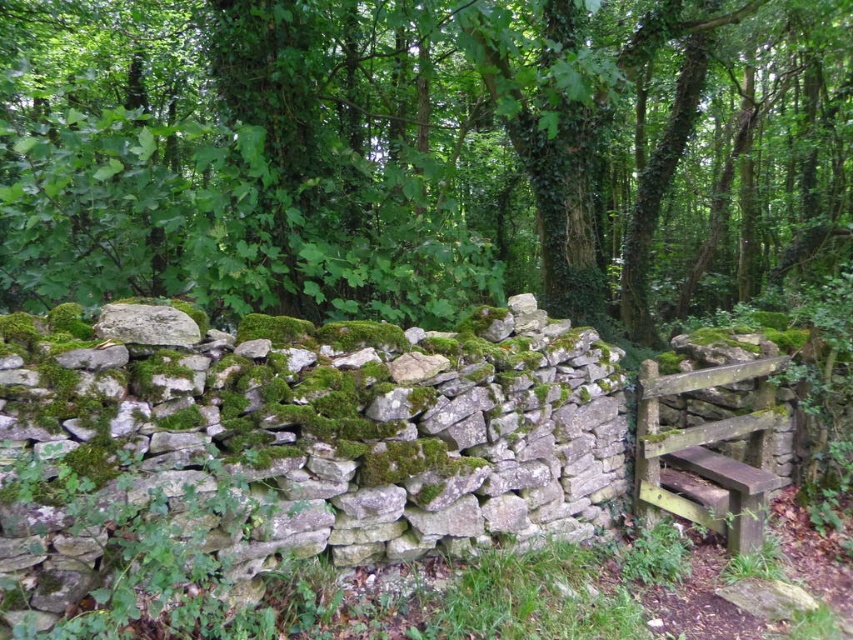
Who is taller, gray stone wall at center or wooden gate at right?

gray stone wall at center

Where is `gray stone wall at center`? gray stone wall at center is located at coordinates (294, 445).

Is green mossy rock at upper left positioned before gray stone wall at center?

No, green mossy rock at upper left is further to the viewer.

Can you confirm if green mossy rock at upper left is positioned to the left of gray stone wall at center?

Incorrect, green mossy rock at upper left is not on the left side of gray stone wall at center.

Who is more forward, (x=44, y=97) or (x=199, y=339)?

Point (x=199, y=339)

Where is `green mossy rock at upper left`? green mossy rock at upper left is located at coordinates (422, 154).

Can you confirm if green mossy rock at upper left is positioned to the left of wooden gate at right?

Correct, you'll find green mossy rock at upper left to the left of wooden gate at right.

Does green mossy rock at upper left lie behind wooden gate at right?

No, green mossy rock at upper left is closer to the viewer.

Who is more distant from viewer, (618, 170) or (717, 529)?

Positioned behind is point (618, 170).

Where is `green mossy rock at upper left`? This screenshot has width=853, height=640. green mossy rock at upper left is located at coordinates (422, 154).